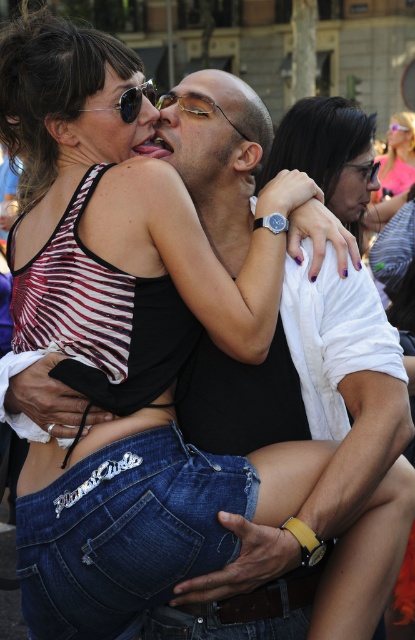
Between matte black sunglasses at upper left and matte black glasses at upper center, which one has more height?

matte black glasses at upper center is taller.

Does point (109, 67) come closer to viewer compared to point (348, 209)?

Yes.

The height and width of the screenshot is (640, 415). Find the location of `matte black sunglasses at upper left`. matte black sunglasses at upper left is located at coordinates (117, 120).

Is matte black sunglasses at upper left below pink matte sunglasses at upper right?

Indeed, matte black sunglasses at upper left is positioned under pink matte sunglasses at upper right.

The width and height of the screenshot is (415, 640). I want to click on matte black sunglasses at upper left, so click(x=117, y=120).

The image size is (415, 640). What do you see at coordinates (117, 120) in the screenshot? I see `matte black sunglasses at upper left` at bounding box center [117, 120].

Where is `matte black sunglasses at upper left`? matte black sunglasses at upper left is located at coordinates (117, 120).

Describe the element at coordinates (353, 188) in the screenshot. I see `matte black glasses at upper center` at that location.

Which of these two, matte black glasses at upper center or matte black sunglasses at upper center, stands shorter?

With less height is matte black sunglasses at upper center.

Find the location of a particular element. The image size is (415, 640). matte black glasses at upper center is located at coordinates (353, 188).

Where is `matte black glasses at upper center`? matte black glasses at upper center is located at coordinates (353, 188).